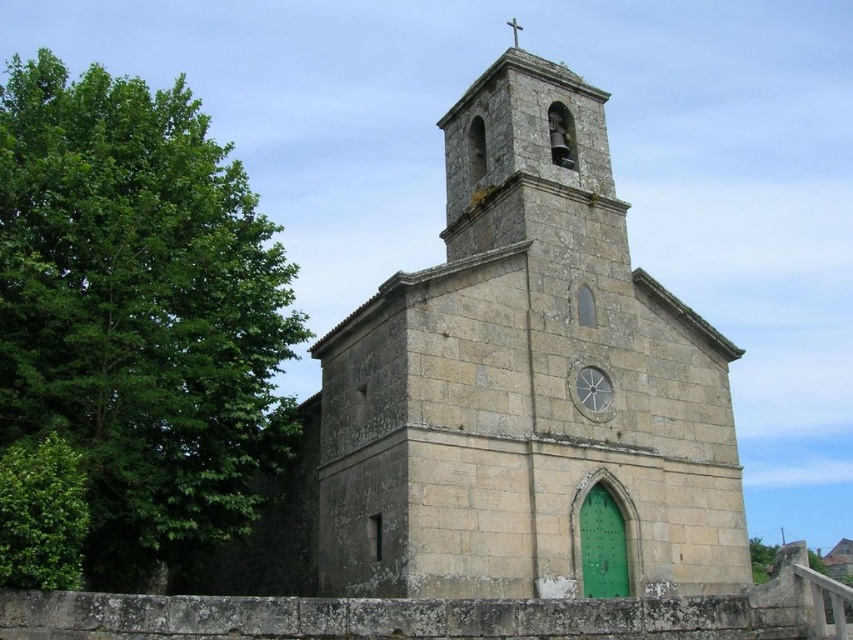
Does stone church at center have a greater height compared to green leafy tree at left?

No, stone church at center is not taller than green leafy tree at left.

Is point (706, 412) more distant than point (213, 304)?

Yes, point (706, 412) is behind point (213, 304).

Is point (563, 484) less distant than point (88, 561)?

No, (563, 484) is further to viewer.

This screenshot has width=853, height=640. What are the coordinates of `stone church at center` in the screenshot? It's located at (527, 384).